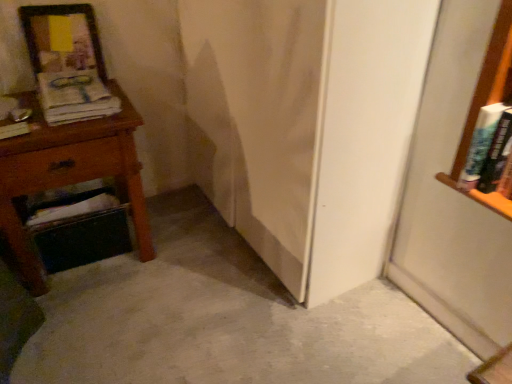
Question: Is hardcover book at left, placed as the first book when sorted from left to right, positioned beyond the bounds of matte paper magazine at left?

Choices:
 (A) yes
 (B) no

Answer: (A)

Question: Is matte paper magazine at left surrounded by hardcover book at left, which ranks as the second book in right-to-left order?

Choices:
 (A) yes
 (B) no

Answer: (B)

Question: Can you confirm if hardcover book at left, placed as the first book when sorted from left to right, is thinner than matte paper magazine at left?

Choices:
 (A) yes
 (B) no

Answer: (A)

Question: Considering the relative sizes of hardcover book at left, placed as the first book when sorted from left to right, and matte paper magazine at left in the image provided, is hardcover book at left, placed as the first book when sorted from left to right, shorter than matte paper magazine at left?

Choices:
 (A) no
 (B) yes

Answer: (B)

Question: Is hardcover book at left, which ranks as the second book in right-to-left order, far away from matte paper magazine at left?

Choices:
 (A) yes
 (B) no

Answer: (B)

Question: Is the surface of hardcover book at left, which ranks as the second book in right-to-left order, in direct contact with matte paper magazine at left?

Choices:
 (A) yes
 (B) no

Answer: (B)

Question: Can you confirm if white glossy screen door at center is smaller than hardcover book at right, the 1th book when ordered from right to left?

Choices:
 (A) no
 (B) yes

Answer: (A)

Question: Considering the relative sizes of white glossy screen door at center and hardcover book at right, the 1th book when ordered from right to left, in the image provided, is white glossy screen door at center taller than hardcover book at right, the 1th book when ordered from right to left,?

Choices:
 (A) no
 (B) yes

Answer: (B)

Question: From a real-world perspective, is white glossy screen door at center positioned over hardcover book at right, the 1th book when ordered from right to left, based on gravity?

Choices:
 (A) yes
 (B) no

Answer: (B)

Question: From the image's perspective, is white glossy screen door at center on hardcover book at right, the 1th book when ordered from right to left?

Choices:
 (A) yes
 (B) no

Answer: (A)

Question: Is white glossy screen door at center closer to camera compared to hardcover book at right, the 2th book from the left?

Choices:
 (A) yes
 (B) no

Answer: (A)

Question: Does white glossy screen door at center turn towards hardcover book at right, the 2th book from the left?

Choices:
 (A) no
 (B) yes

Answer: (A)

Question: From the image's perspective, is hardcover book at right, the 1th book when ordered from right to left, located beneath hardcover book at left, placed as the first book when sorted from left to right?

Choices:
 (A) no
 (B) yes

Answer: (B)